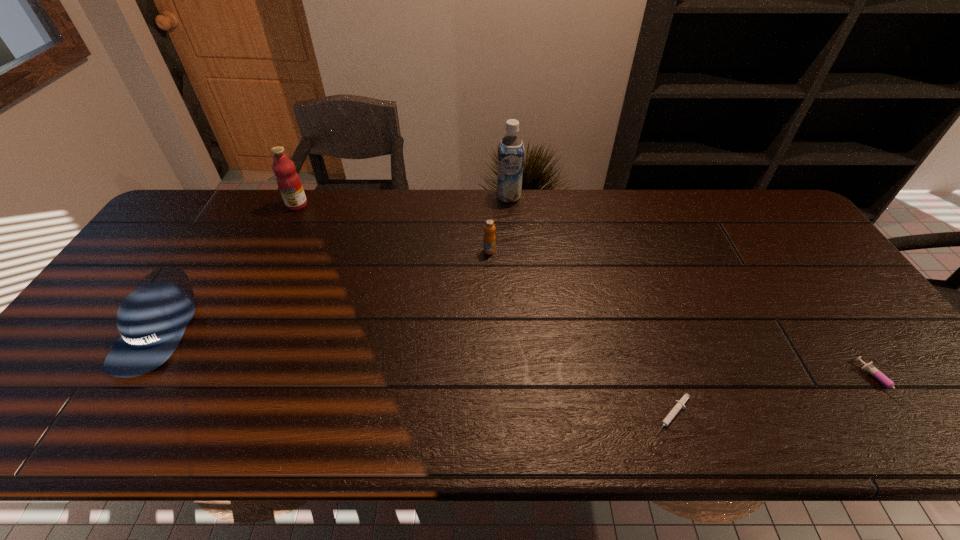
Locate an element on the screen. This screenshot has height=540, width=960. empty space that is in between the taller syringe and the third object from left to right is located at coordinates (684, 317).

Find the location of a particular element. blank region between the leftmost object and the orange juice is located at coordinates (323, 292).

The image size is (960, 540). Find the location of `free space between the tallest object and the shorter syringe`. free space between the tallest object and the shorter syringe is located at coordinates (590, 306).

Locate an element on the screen. free space that is in between the fruit juice and the shorter syringe is located at coordinates (484, 310).

Find the location of a particular element. The height and width of the screenshot is (540, 960). vacant space that's between the third farthest object and the taller syringe is located at coordinates tap(684, 317).

Where is `vacant point located between the orange juice and the right syringe`? vacant point located between the orange juice and the right syringe is located at coordinates (684, 317).

You are a GUI agent. You are given a task and a screenshot of the screen. Output one action in this format:
    pyautogui.click(x=<x>, y=<y>)
    Task: Click on the vacant region between the second object from right to left and the second shortest object
    
    Given the screenshot: What is the action you would take?
    pyautogui.click(x=776, y=399)

At what (x,y) coordinates should I click in order to perform the action: click on object that is the closest to the fifth tallest object. Please return your answer as a coordinate pair (x, y). The image size is (960, 540). Looking at the image, I should click on (679, 404).

This screenshot has height=540, width=960. In order to click on object that ranks as the closest to the baseball cap in this screenshot , I will do `click(288, 180)`.

Find the location of a particular element. This screenshot has width=960, height=540. free location that satisfies the following two spatial constraints: 1. on the label of the right syringe; 2. on the left side of the fourth object from left to right is located at coordinates (523, 383).